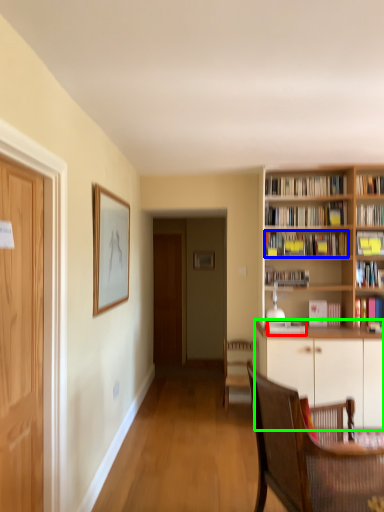
Question: Which is nearer to the book (highlighted by a red box)? book (highlighted by a blue box) or cabinetry (highlighted by a green box).

Choices:
 (A) book
 (B) cabinetry

Answer: (B)